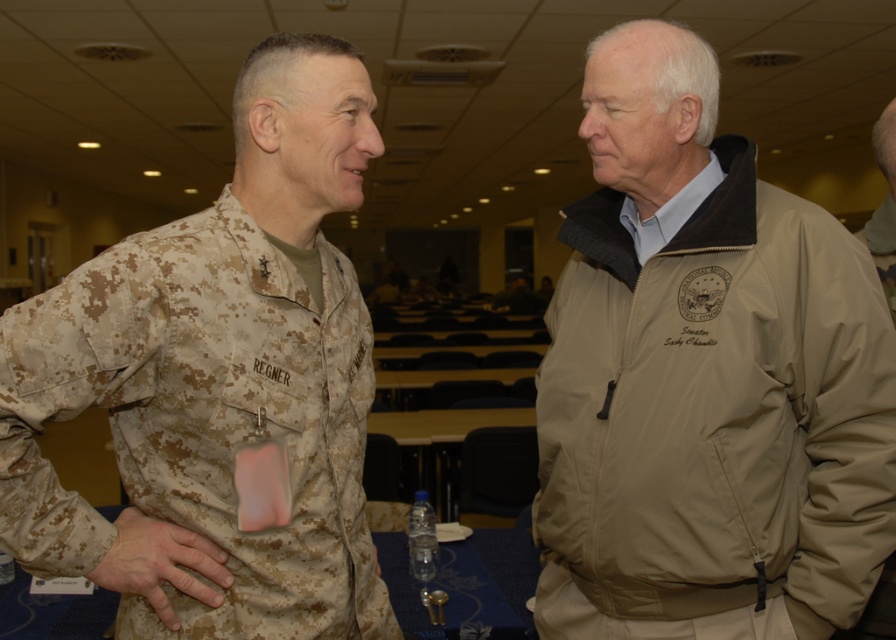
You are an event planner arranging seating for a formal dinner. You notice two items in the image that have camouflage fabric. One is the camouflage fabric uniform at left and the other is the camouflage fabric hand at center. Which camouflage fabric item is closer to you as you look at the image?

The camouflage fabric uniform at left is closer to you because it is in front of the camouflage fabric hand at center.

You are standing in the conference room and need to locate the camouflage fabric uniform at left. According to the coordinates provided, where exactly is it positioned?

The camouflage fabric uniform at left is located at point 0.659 on the x axis and 0.225 on the y axis.

You are a photographer setting up for a group photo. You need to ensure that both the tan fabric jacket at center and the camouflage fabric uniform at left are fully visible in the frame. Based on their widths, which one might require more space horizontally to fit properly?

The tan fabric jacket at center might be wider than the camouflage fabric uniform at left, so it might require more horizontal space to ensure it fits properly in the frame.